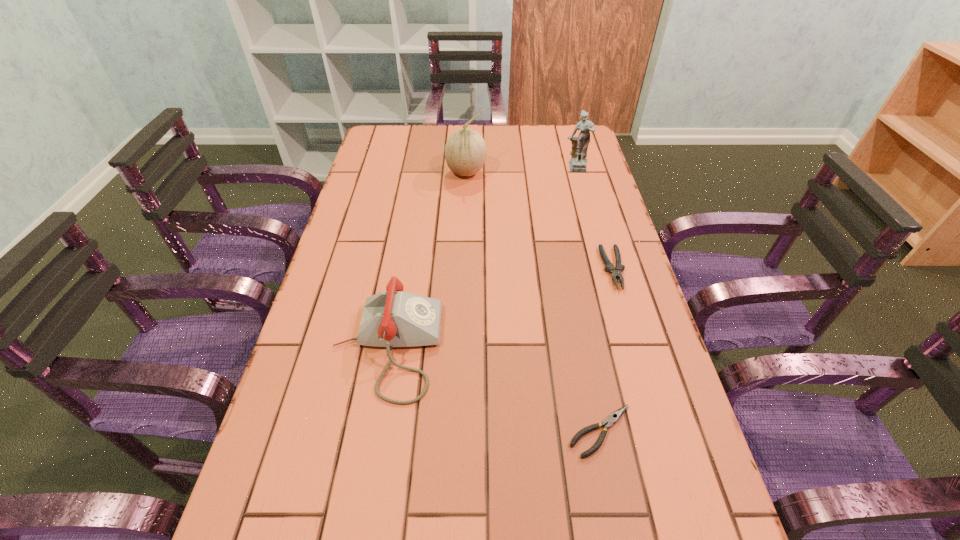
Find the location of a particular element. The height and width of the screenshot is (540, 960). empty location between the figurine and the taller pliers is located at coordinates (594, 219).

What are the coordinates of `vacant area between the telephone and the figurine` in the screenshot? It's located at (481, 258).

The width and height of the screenshot is (960, 540). I want to click on vacant space in between the third shortest object and the figurine, so click(481, 258).

Identify the location of free space between the shortest object and the right pliers. Image resolution: width=960 pixels, height=540 pixels. click(607, 350).

The image size is (960, 540). What are the coordinates of `vacant area that lies between the telephone and the left pliers` in the screenshot? It's located at (494, 389).

The width and height of the screenshot is (960, 540). I want to click on free point between the figurine and the farther pliers, so click(594, 219).

At what (x,y) coordinates should I click in order to perform the action: click on free spot between the shortest object and the third shortest object. Please return your answer as a coordinate pair (x, y). Looking at the image, I should click on (494, 389).

At what (x,y) coordinates should I click in order to perform the action: click on free space between the figurine and the cantaloup. Please return your answer as a coordinate pair (x, y). Looking at the image, I should click on (520, 171).

Where is `vacant area that lies between the right pliers and the figurine`? This screenshot has width=960, height=540. vacant area that lies between the right pliers and the figurine is located at coordinates (594, 219).

Choose which object is the second nearest neighbor to the cantaloup. Please provide its 2D coordinates. Your answer should be formatted as a tuple, i.e. [(x, y)], where the tuple contains the x and y coordinates of a point satisfying the conditions above.

[(615, 272)]